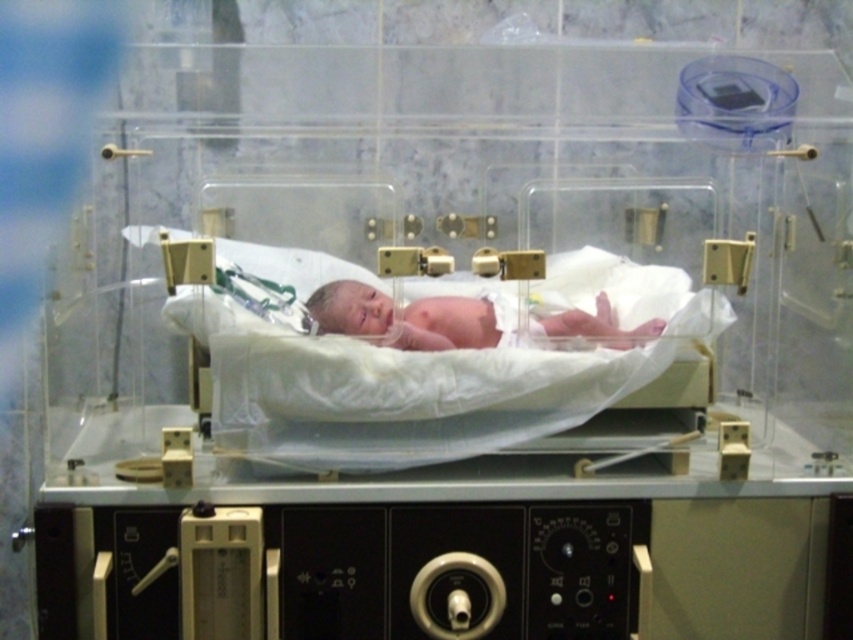
The height and width of the screenshot is (640, 853). Describe the element at coordinates (433, 372) in the screenshot. I see `white fabric hospital bed at center` at that location.

Which of these two, white fabric hospital bed at center or pink smooth skin at center, stands shorter?

pink smooth skin at center is shorter.

Which is behind, point (303, 284) or point (431, 314)?

The point (303, 284) is more distant.

This screenshot has height=640, width=853. I want to click on white fabric hospital bed at center, so click(x=433, y=372).